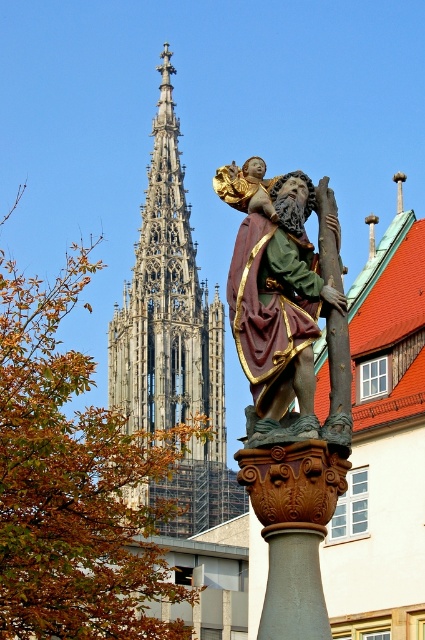
You are standing at the center of the image. Which direction should you move to get closer to the polychrome wood statue of saint christopher at center?

The polychrome wood statue of saint christopher at center is already at the center of the image, so you don not need to move in any direction to get closer.

Consider the image. Based on the scene description, which object is wider between the stone gothic spire at upper left and the smooth gray stone pillar at center?

The stone gothic spire at upper left is wider than the smooth gray stone pillar at center according to the description.

Based on the photo, you are a drone operator tasked with capturing aerial footage of the stone gothic spire at upper left. Your drone has a maximum flight range of 150 meters. Can your drone safely reach the spire from your current position?

The distance between the stone gothic spire at upper left and the camera is 134.86 meters, which is within the drone operator drone maximum flight range of 150 meters. Yes, the drone can safely reach the spire from the current position.